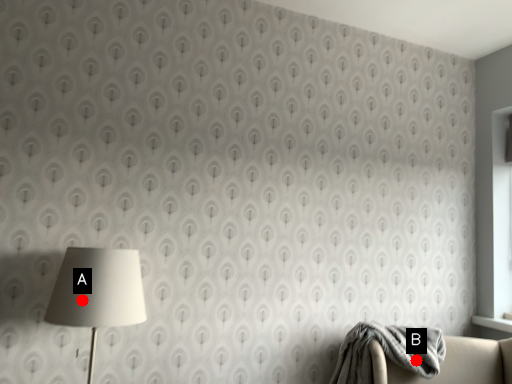
Question: Two points are circled on the image, labeled by A and B beside each circle. Among these points, which one is nearest to the camera?

Choices:
 (A) A is closer
 (B) B is closer

Answer: (A)